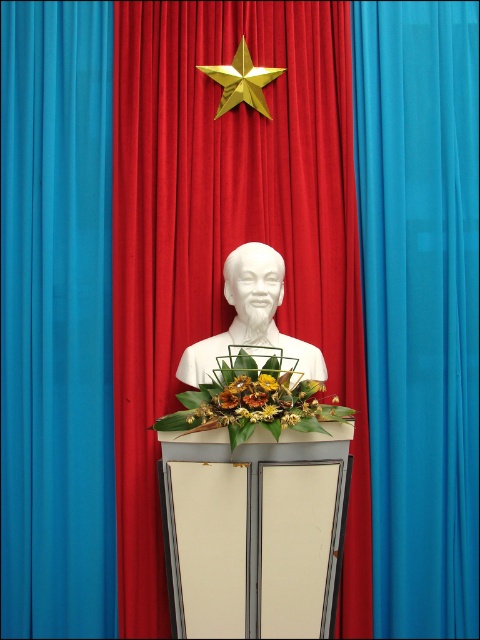
Question: Which point is farther from the camera taking this photo?

Choices:
 (A) (176, 429)
 (B) (418, 243)
 (C) (266, 76)

Answer: (C)

Question: Based on their relative distances, which object is farther from the gold metallic star at upper center?

Choices:
 (A) blue fabric curtain at center
 (B) white matte bust at center
 (C) yellow fabric flower at center

Answer: (C)

Question: In this image, where is white matte bust at center located relative to gold metallic star at upper center?

Choices:
 (A) left
 (B) right

Answer: (B)

Question: Where is white marble bust at center located in relation to white matte bust at center in the image?

Choices:
 (A) above
 (B) below

Answer: (B)

Question: Can you confirm if blue fabric curtain at center is positioned to the right of gold metallic star at upper center?

Choices:
 (A) no
 (B) yes

Answer: (A)

Question: Estimate the real-world distances between objects in this image. Which object is closer to the white marble bust at center?

Choices:
 (A) floral bouquet at center
 (B) yellow fabric flower at center

Answer: (A)